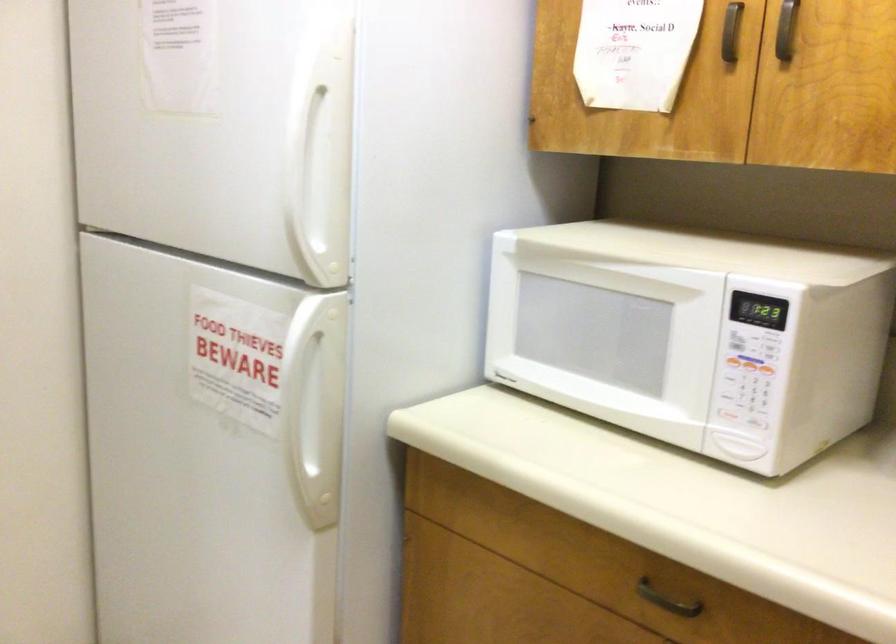
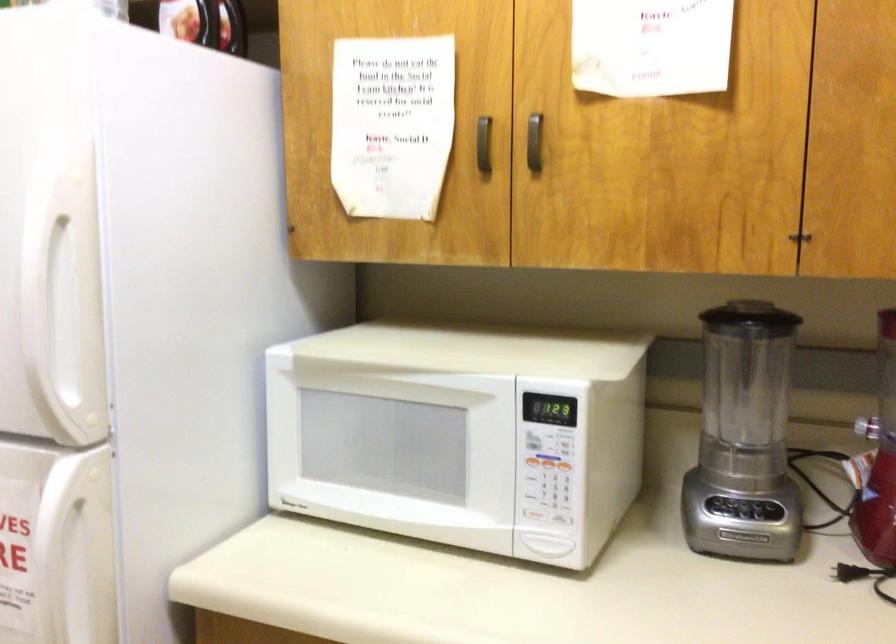
Find the pixel in the second image that matches (765,366) in the first image.

(565, 467)